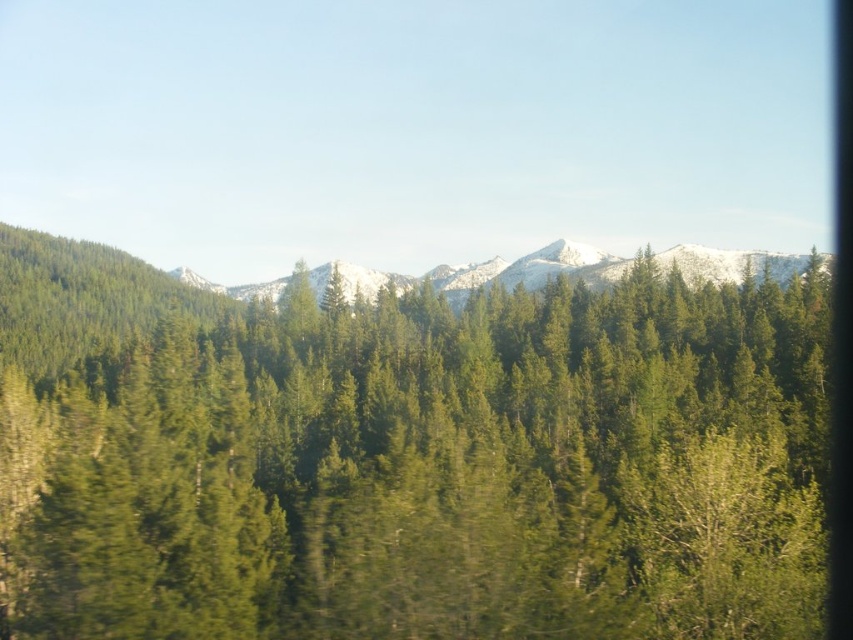
Question: Observing the image, what is the correct spatial positioning of green matte tree at center in reference to snowy rocky mountain at center?

Choices:
 (A) right
 (B) left

Answer: (B)

Question: Does green matte tree at center have a greater width compared to snowy rocky mountain at center?

Choices:
 (A) no
 (B) yes

Answer: (A)

Question: Does green matte tree at center have a greater width compared to snowy rocky mountain at center?

Choices:
 (A) yes
 (B) no

Answer: (B)